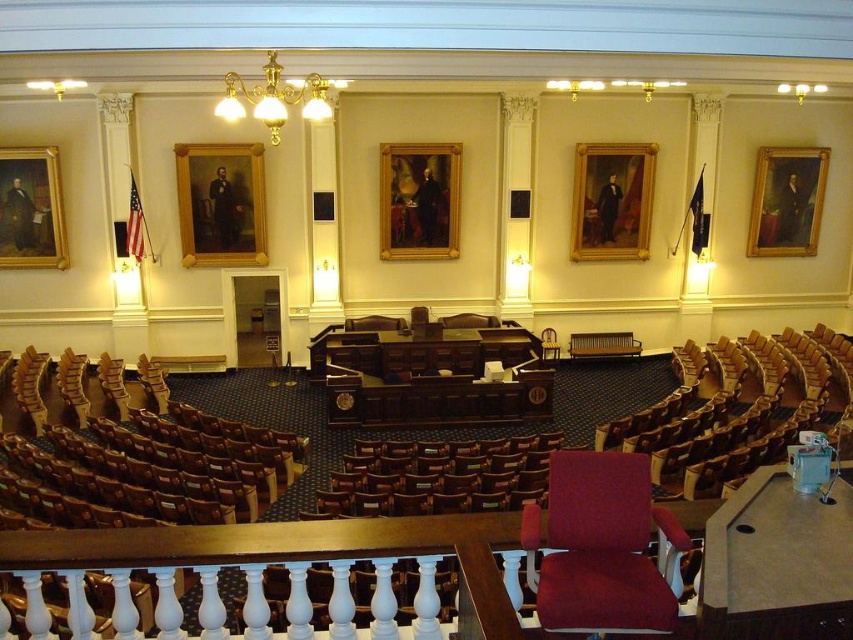
You are a photographer positioned at the back of the legislative chamber. You want to take a photo of the wooden chair at center without the goldwooden frame at upper center blocking it. Is this possible given their positions?

The goldwooden frame at upper center is in front of the wooden chair at center, so it will block the view. To capture the wooden chair at center without obstruction, you would need to move to a position where the goldwooden frame at upper center is not between you and the chair.